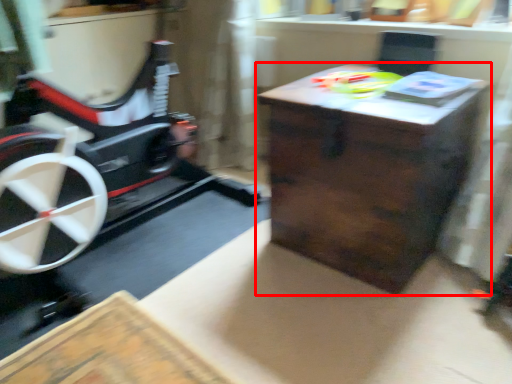
Question: From the image, what is the correct spatial relationship of table (annotated by the red box) in relation to toy?

Choices:
 (A) left
 (B) right

Answer: (B)